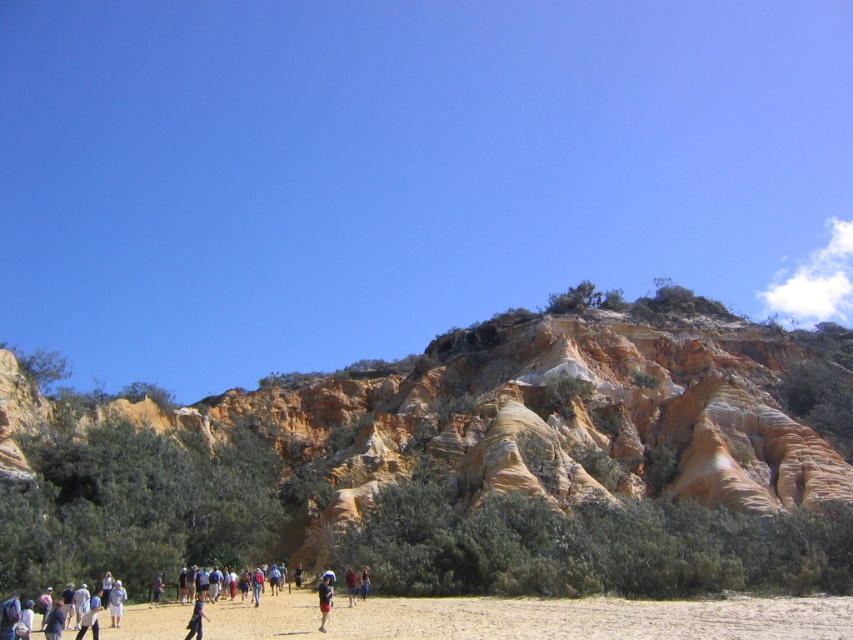
Does point (355, 580) come closer to viewer compared to point (154, 604)?

Yes.

Who is higher up, maroon fabric shorts at lower center or light blue fabric at center?

light blue fabric at center is above.

What do you see at coordinates (351, 586) in the screenshot? This screenshot has height=640, width=853. I see `maroon fabric shorts at lower center` at bounding box center [351, 586].

Image resolution: width=853 pixels, height=640 pixels. Identify the location of maroon fabric shorts at lower center. (351, 586).

This screenshot has height=640, width=853. I want to click on dark blue jeans at center, so click(196, 618).

Between dark blue jeans at center and blue denim shorts at center, which one is positioned lower?

blue denim shorts at center is lower down.

Find the location of a particular element. dark blue jeans at center is located at coordinates (196, 618).

Which is in front, point (206, 611) or point (200, 632)?

Point (200, 632) is more forward.

What do you see at coordinates (534, 618) in the screenshot?
I see `light brown sand at lower center` at bounding box center [534, 618].

Where is `light brown sand at lower center`? Image resolution: width=853 pixels, height=640 pixels. light brown sand at lower center is located at coordinates (534, 618).